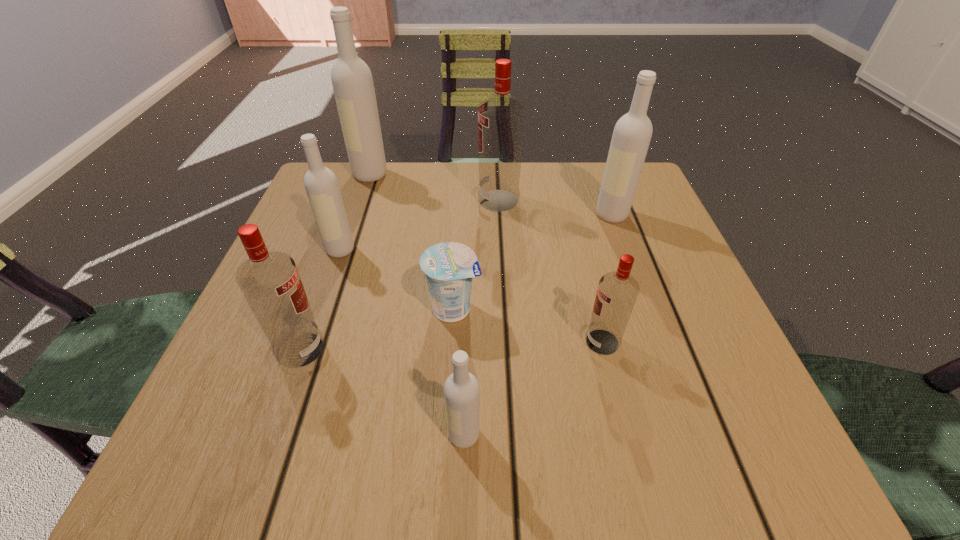
Locate an element on the screen. This screenshot has width=960, height=540. the farthest vodka is located at coordinates tap(352, 81).

I want to click on the farthest object, so click(352, 81).

Locate an element on the screen. The width and height of the screenshot is (960, 540). the farthest red vodka is located at coordinates (501, 118).

At what (x,y) coordinates should I click in order to perform the action: click on the biggest red vodka. Please return your answer as a coordinate pair (x, y). This screenshot has height=540, width=960. Looking at the image, I should click on (501, 118).

Where is `the rightmost vodka`? Image resolution: width=960 pixels, height=540 pixels. the rightmost vodka is located at coordinates (632, 133).

At what (x,y) coordinates should I click in order to perform the action: click on the rightmost object. Please return your answer as a coordinate pair (x, y). Image resolution: width=960 pixels, height=540 pixels. Looking at the image, I should click on (632, 133).

Where is `the second nearest white vodka`? This screenshot has height=540, width=960. the second nearest white vodka is located at coordinates (322, 188).

Where is `the fourth farthest object`? the fourth farthest object is located at coordinates (322, 188).

Find the location of `the leftmost red vodka`. the leftmost red vodka is located at coordinates (270, 282).

Identify the location of the seventh object from left to right. (617, 292).